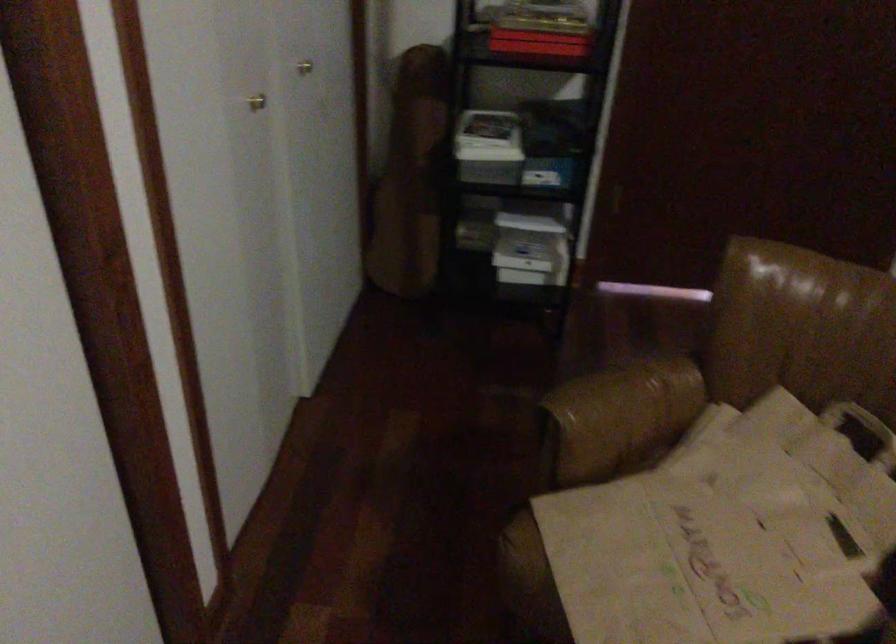
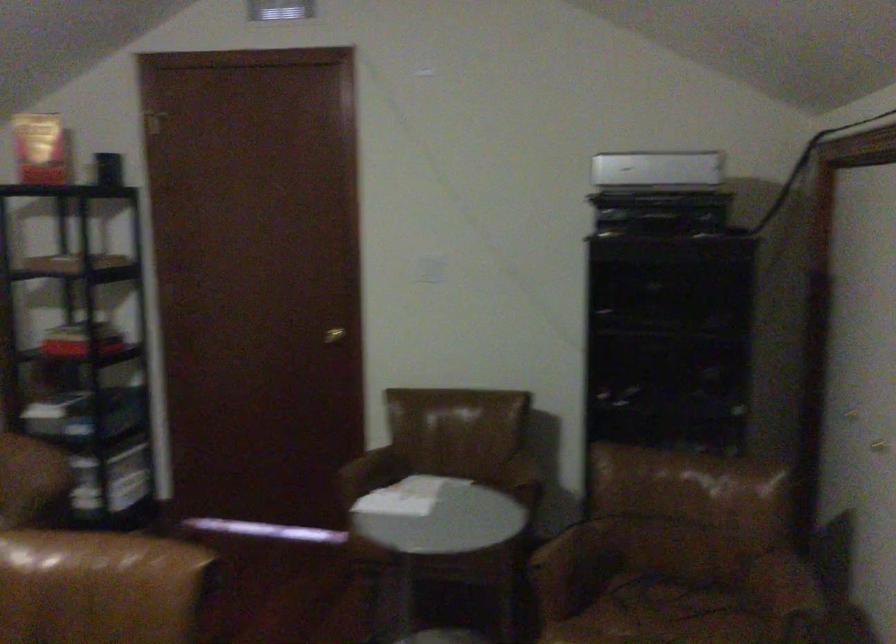
The images are taken continuously from a first-person perspective. In which direction are you moving?

The cameraman moved toward right, backward.